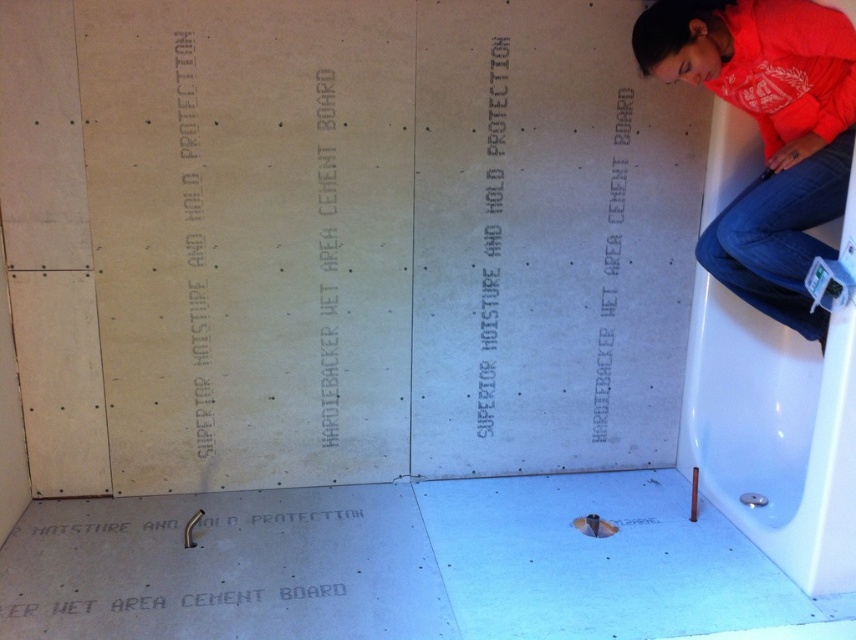
Question: Does orange cotton shirt at upper right come in front of white matte text at center?

Choices:
 (A) yes
 (B) no

Answer: (A)

Question: Can you confirm if white matte writing at upper left is smaller than white matte hardiebacker wet area cement board at center?

Choices:
 (A) no
 (B) yes

Answer: (A)

Question: Among these objects, which one is nearest to the camera?

Choices:
 (A) orange cotton shirt at upper right
 (B) white matte text at center
 (C) white matte hardiebacker wet area cement board at center
 (D) white matte writing at upper left

Answer: (A)

Question: Among these objects, which one is nearest to the camera?

Choices:
 (A) white matte cement board at upper right
 (B) white matte hardiebacker wet area cement board at center
 (C) white matte text at center
 (D) white matte writing at upper left

Answer: (D)

Question: Which is farther from the white matte writing at upper left?

Choices:
 (A) white matte cement board at upper right
 (B) white matte hardiebacker wet area cement board at center

Answer: (A)

Question: From the image, what is the correct spatial relationship of white matte hardiebacker wet area cement board at center in relation to white matte cement board at upper right?

Choices:
 (A) below
 (B) above

Answer: (B)